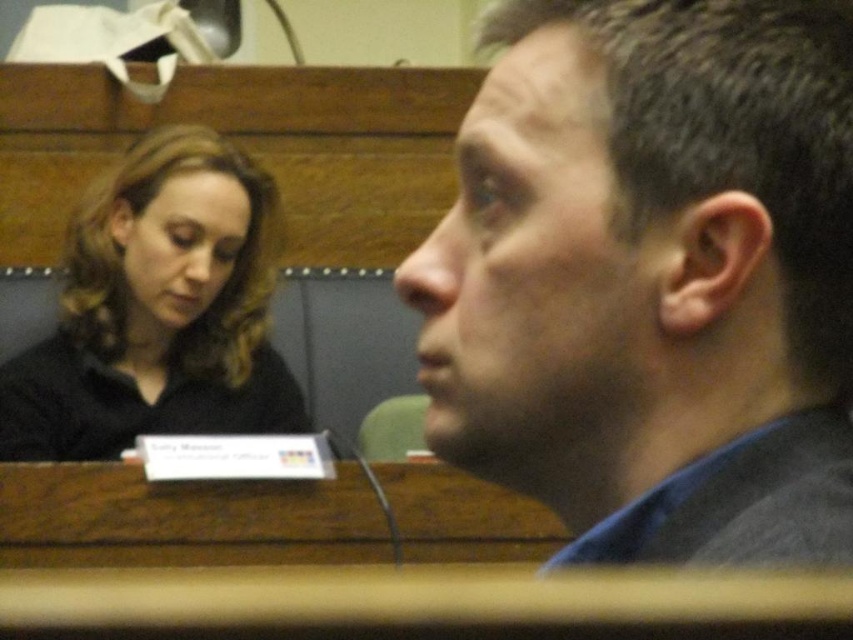
Is dark gray hair at upper right shorter than black matte hair at upper left?

Yes, dark gray hair at upper right is shorter than black matte hair at upper left.

Who is taller, dark gray hair at upper right or black matte hair at upper left?

black matte hair at upper left

Measure the distance between dark gray hair at upper right and camera.

dark gray hair at upper right is 11.82 inches from camera.

You are a GUI agent. You are given a task and a screenshot of the screen. Output one action in this format:
    pyautogui.click(x=<x>, y=<y>)
    Task: Click on the dark gray hair at upper right
    The height and width of the screenshot is (640, 853).
    Given the screenshot: What is the action you would take?
    pyautogui.click(x=653, y=278)